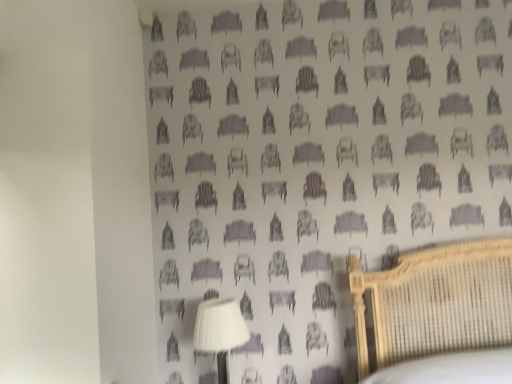
The height and width of the screenshot is (384, 512). Describe the element at coordinates (220, 331) in the screenshot. I see `white matte table lamp at lower center` at that location.

Measure the distance between point (226, 341) and camera.

Point (226, 341) is 1.72 meters away from camera.

In the scene shown: Measure the distance between white matte table lamp at lower center and camera.

white matte table lamp at lower center is 1.70 meters away from camera.

The height and width of the screenshot is (384, 512). I want to click on white matte table lamp at lower center, so click(x=220, y=331).

Find the location of `white matte table lamp at lower center`. white matte table lamp at lower center is located at coordinates (220, 331).